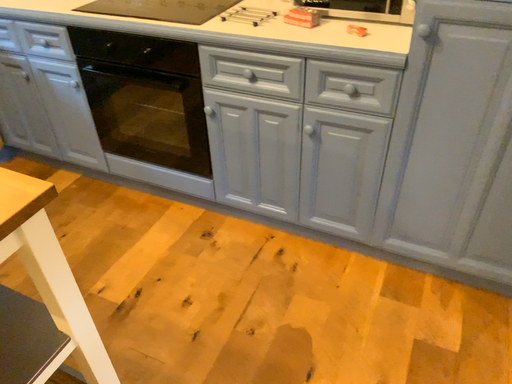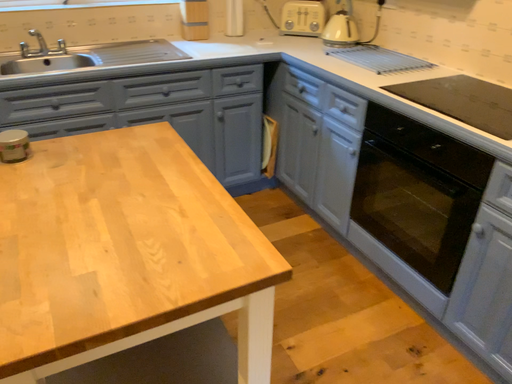
Question: How did the camera likely rotate when shooting the video?

Choices:
 (A) rotated downward
 (B) rotated upward

Answer: (B)